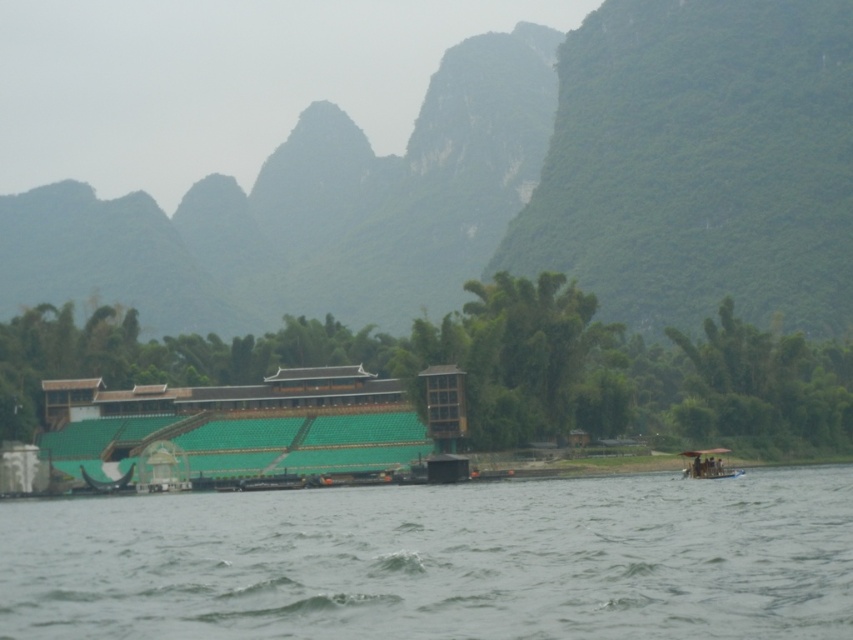
You are standing on the riverside and want to take a photo of the green textured mountain at upper center and the wooden boat at lower right. Which object should you position to your left side in the frame to capture both in the same photo?

You should position the green textured mountain at upper center to your left side in the frame because it is located to the left of the wooden boat at lower right.

You are a tour guide leading a group along the riverside path. You want to ensure everyone can comfortably walk from the gray water at lower center to the black glossy boat at lower left. If each person requires 0.5 meters of space, how many people can walk side by side along this path?

The distance between the gray water at lower center and the black glossy boat at lower left is 46.05 meters. If each person needs 0.5 meters of space, dividing 46.05 by 0.5 gives approximately 92.1, so 92 people can walk side by side.